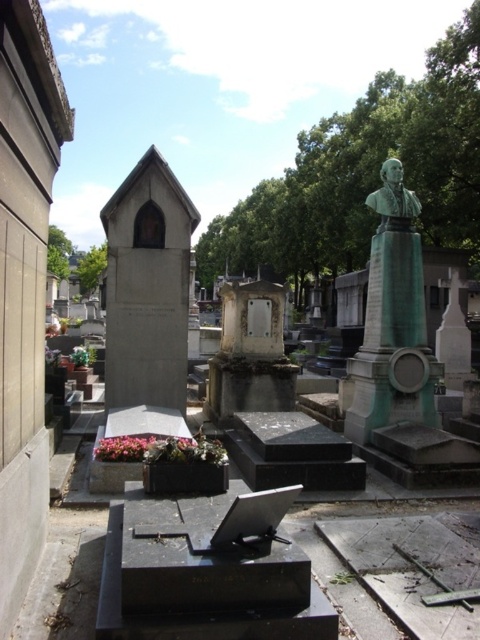
Measure the distance between white marble tombstone at center and camera.

white marble tombstone at center is 7.52 meters from camera.

Find the location of a particular element. Image resolution: width=480 pixels, height=640 pixels. white marble tombstone at center is located at coordinates (251, 353).